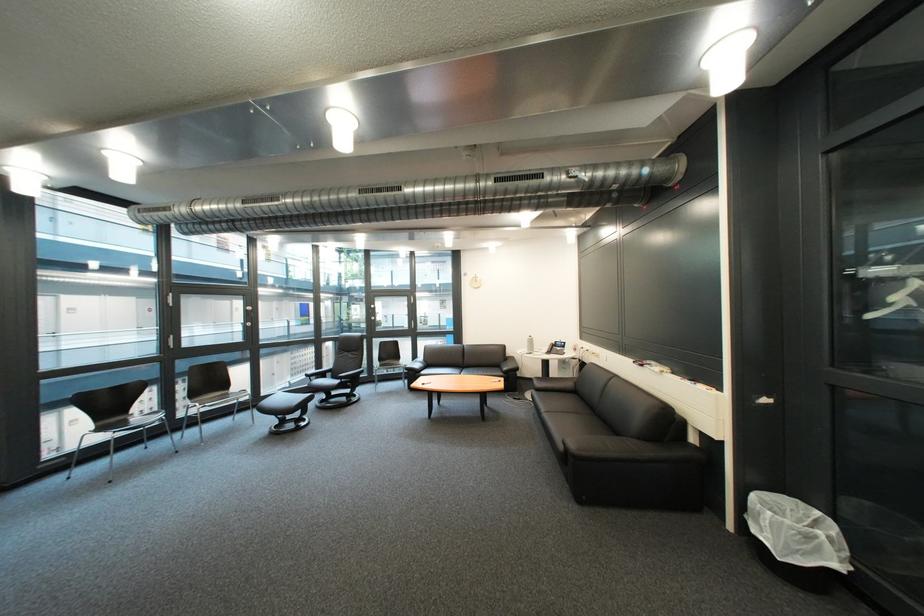
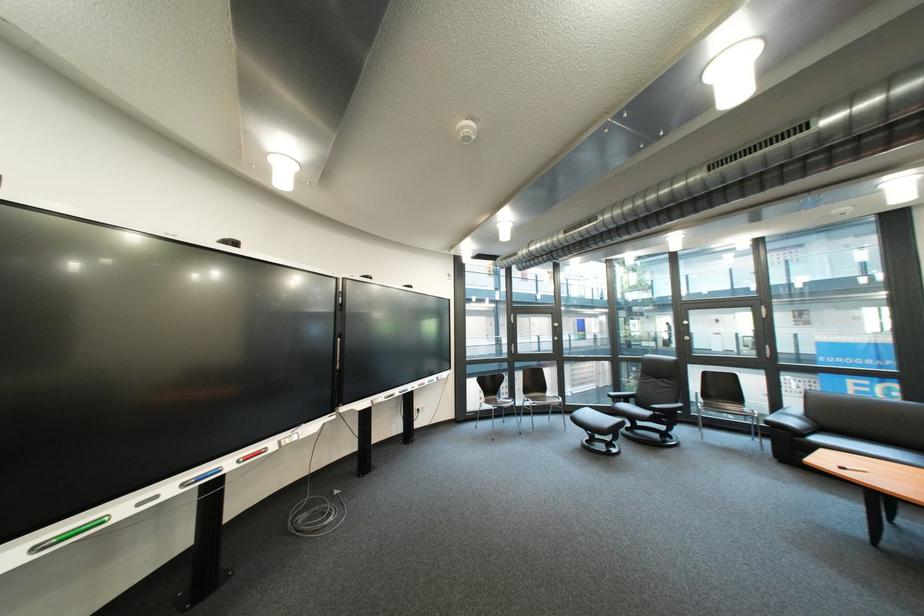
In the second image, find the point that corresponds to (x=430, y=367) in the first image.

(806, 423)